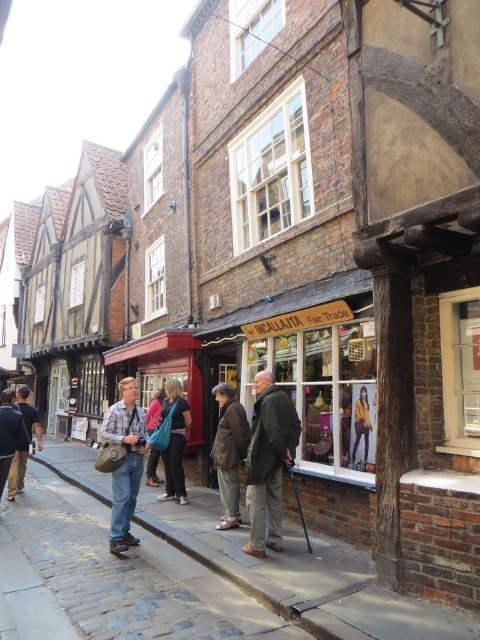
Question: Which point is farther to the camera?

Choices:
 (A) (118, 416)
 (B) (363, 420)
 (C) (238, 467)
 (D) (156, 428)

Answer: (D)

Question: Among these points, which one is nearest to the camera?

Choices:
 (A) (111, 481)
 (B) (180, 492)
 (C) (88, 468)

Answer: (B)

Question: Does plaid shirt at center lie behind dark brown leather jacket at center?

Choices:
 (A) yes
 (B) no

Answer: (B)

Question: Is dark brown leather jacket at center below dark brown leather jacket at left?

Choices:
 (A) no
 (B) yes

Answer: (B)

Question: Which object appears closest to the camera in this image?

Choices:
 (A) dark green jacket at center
 (B) denim jacket at center
 (C) dark brown leather jacket at left

Answer: (A)

Question: Does cobblestone pavement at lower left appear on the right side of plaid shirt at center?

Choices:
 (A) no
 (B) yes

Answer: (B)